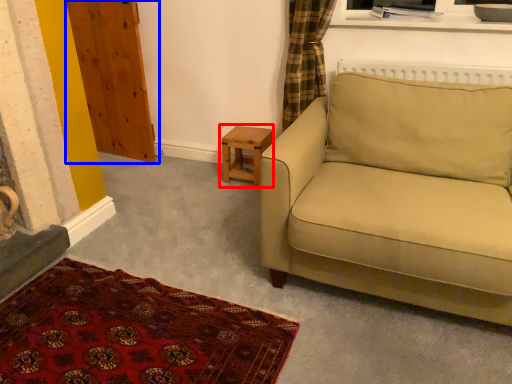
Question: Which object appears farthest to the camera in this image, table (highlighted by a red box) or armoire (highlighted by a blue box)?

Choices:
 (A) table
 (B) armoire

Answer: (A)